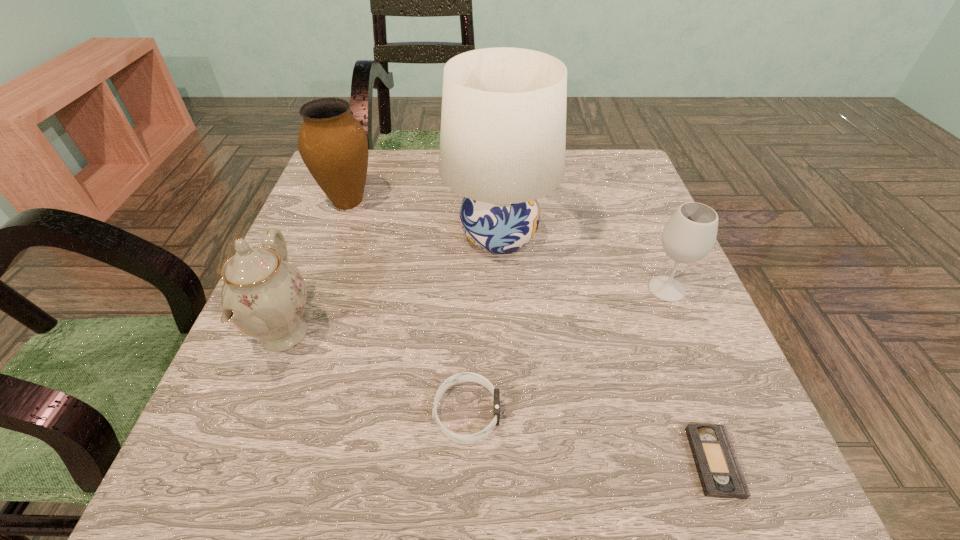
You are a GUI agent. You are given a task and a screenshot of the screen. Output one action in this format:
    pyautogui.click(x=<x>, y=<y>)
    Task: Click on the videotape that is at the right edge
    
    Given the screenshot: What is the action you would take?
    pyautogui.click(x=719, y=471)

Find the location of a particular element. The image size is (960, 540). object that is at the far left corner is located at coordinates (333, 145).

Locate an element on the screen. object located at the near right corner is located at coordinates (719, 471).

In order to click on vacant space at the near edge of the desktop in this screenshot , I will do `click(471, 481)`.

In the image, there is a desktop. Where is `vacant space at the left edge`? Image resolution: width=960 pixels, height=540 pixels. vacant space at the left edge is located at coordinates (314, 393).

Find the location of a particular element. vacant space at the right edge of the desktop is located at coordinates (711, 353).

Where is `free space at the near left corner of the desktop`? This screenshot has height=540, width=960. free space at the near left corner of the desktop is located at coordinates (180, 502).

Where is `vacant space in between the tallest object and the fourth tallest object`? vacant space in between the tallest object and the fourth tallest object is located at coordinates (583, 262).

Locate an element on the screen. free space between the tallest object and the wineglass is located at coordinates (583, 262).

Identify the location of free space between the videotape and the tallest object. (607, 349).